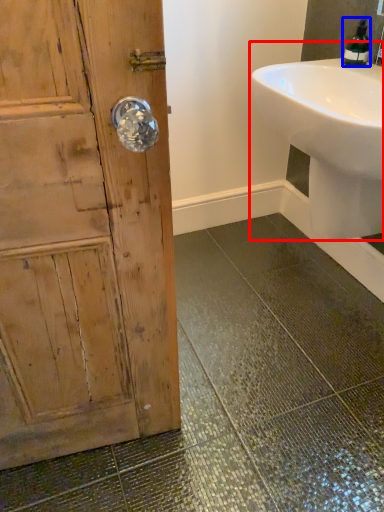
Question: Which object is further to the camera taking this photo, sink (highlighted by a red box) or soap dispenser (highlighted by a blue box)?

Choices:
 (A) sink
 (B) soap dispenser

Answer: (B)